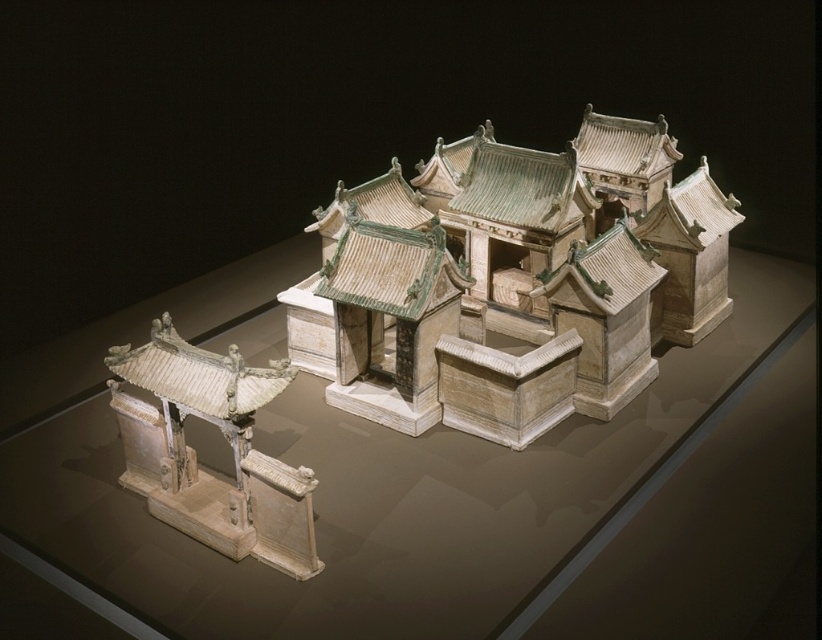
Question: Is the position of white stone building at center less distant than that of white ceramic gate at lower left?

Choices:
 (A) no
 (B) yes

Answer: (A)

Question: Which of the following is the closest to the observer?

Choices:
 (A) transparent glass table at center
 (B) white stone building at center

Answer: (A)

Question: Does white stone building at center have a smaller size compared to white ceramic gate at lower left?

Choices:
 (A) no
 (B) yes

Answer: (A)

Question: Is white stone building at center above white ceramic gate at lower left?

Choices:
 (A) yes
 (B) no

Answer: (A)

Question: Which point is closer to the camera taking this photo?

Choices:
 (A) (137, 548)
 (B) (127, 451)

Answer: (A)

Question: Which point is closer to the camera?

Choices:
 (A) (67, 422)
 (B) (399, 403)
 (C) (215, 356)

Answer: (C)